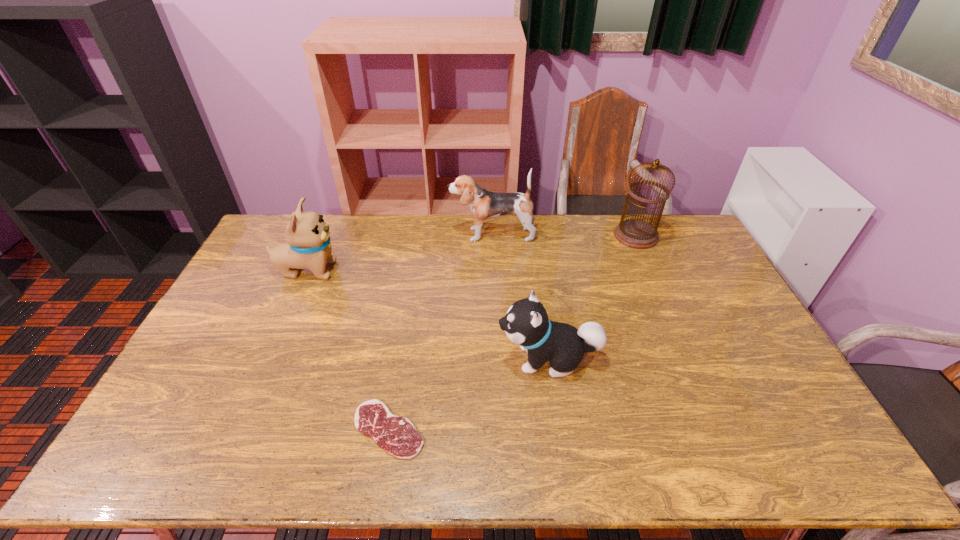
Find the location of a particular element. The height and width of the screenshot is (540, 960). free space between the second farthest puppy and the nearest puppy is located at coordinates pos(428,314).

Identify the location of empty space between the farthest puppy and the second shortest object. The image size is (960, 540). (520, 296).

You are a GUI agent. You are given a task and a screenshot of the screen. Output one action in this format:
    pyautogui.click(x=<x>, y=<y>)
    Task: Click on the free space between the farthest puppy and the steak
    
    Given the screenshot: What is the action you would take?
    pyautogui.click(x=441, y=332)

The height and width of the screenshot is (540, 960). I want to click on free space between the nearest puppy and the farthest puppy, so click(x=520, y=296).

In order to click on free spot between the farthest puppy and the second nearest puppy in this screenshot , I will do `click(400, 252)`.

I want to click on free spot between the farthest puppy and the shortest object, so click(x=441, y=332).

What are the coordinates of `vacant space that is in between the farthest puppy and the fourth object from right to left` in the screenshot? It's located at (441, 332).

Image resolution: width=960 pixels, height=540 pixels. Find the location of `unoccupied position between the leftmost object and the shortest puppy`. unoccupied position between the leftmost object and the shortest puppy is located at coordinates (428, 314).

Select which object appears as the second closest to the nearest object. Please provide its 2D coordinates. Your answer should be formatted as a tuple, i.e. [(x, y)], where the tuple contains the x and y coordinates of a point satisfying the conditions above.

[(308, 245)]

Locate which object ranks third in proximity to the second object from left to right. Please provide its 2D coordinates. Your answer should be formatted as a tuple, i.e. [(x, y)], where the tuple contains the x and y coordinates of a point satisfying the conditions above.

[(484, 204)]